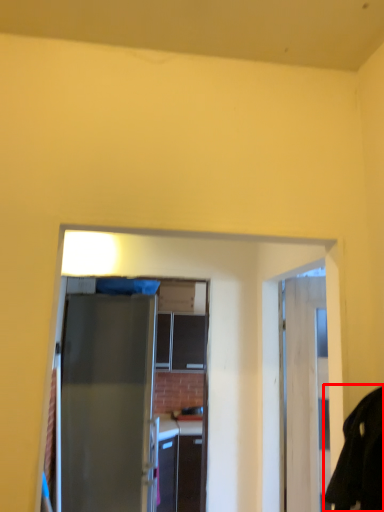
Question: From the image's perspective, considering the relative positions of robe (annotated by the red box) and door in the image provided, where is robe (annotated by the red box) located with respect to the staircase?

Choices:
 (A) above
 (B) below

Answer: (A)